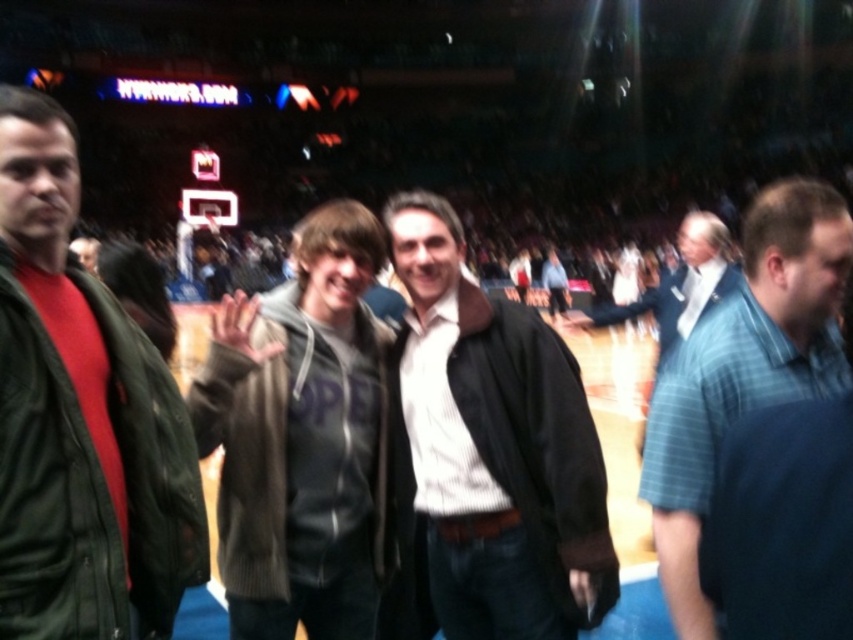
Describe the element at coordinates (489, 456) in the screenshot. This screenshot has height=640, width=853. I see `matte black jacket at center` at that location.

Can you confirm if matte black jacket at center is positioned below gray hoodie at center?

Correct, matte black jacket at center is located below gray hoodie at center.

Find the location of a particular element. The width and height of the screenshot is (853, 640). matte black jacket at center is located at coordinates (489, 456).

Is green leather jacket at left thinner than matte black jacket at center?

Indeed, green leather jacket at left has a lesser width compared to matte black jacket at center.

Does point (76, 560) come behind point (502, 588)?

No, it is in front of (502, 588).

Where is `green leather jacket at left`? The image size is (853, 640). green leather jacket at left is located at coordinates (80, 419).

Does gray hoodie at center appear under blue plaid suit at center?

Yes, gray hoodie at center is below blue plaid suit at center.

Based on the photo, is gray hoodie at center above blue plaid suit at center?

No.

What do you see at coordinates (303, 438) in the screenshot? I see `gray hoodie at center` at bounding box center [303, 438].

Identify the location of gray hoodie at center. Image resolution: width=853 pixels, height=640 pixels. (303, 438).